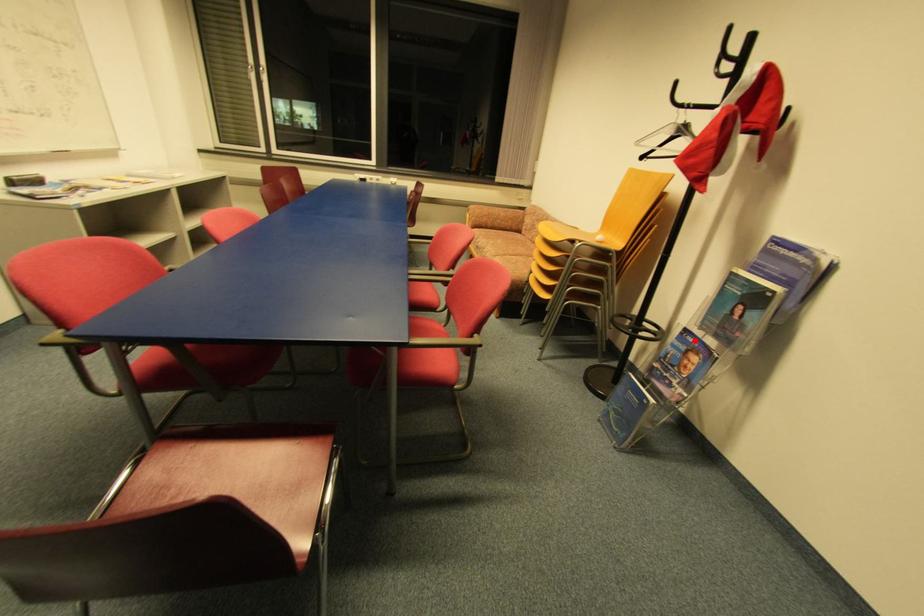
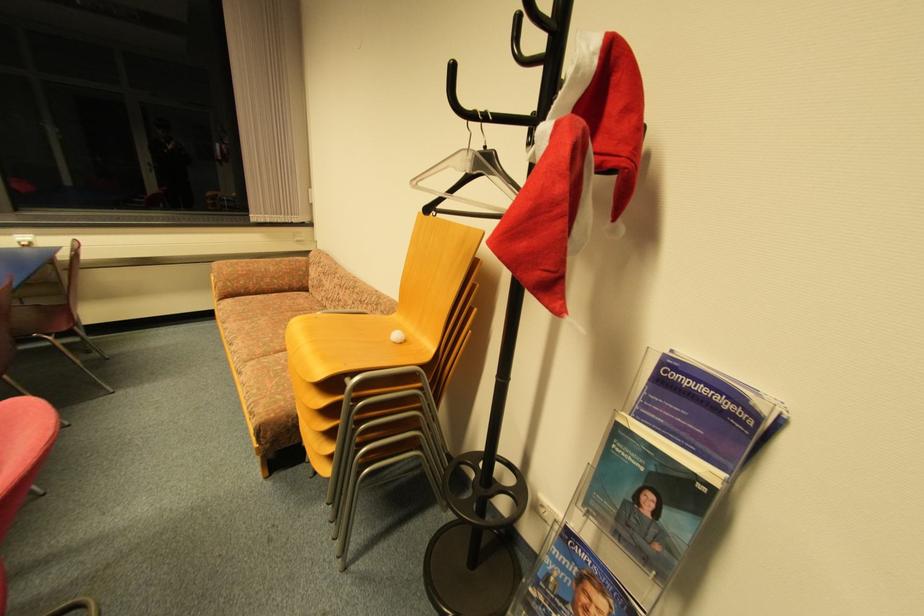
The point at the highlighted location is marked in the first image. Where is the corresponding point in the second image?

(588, 557)